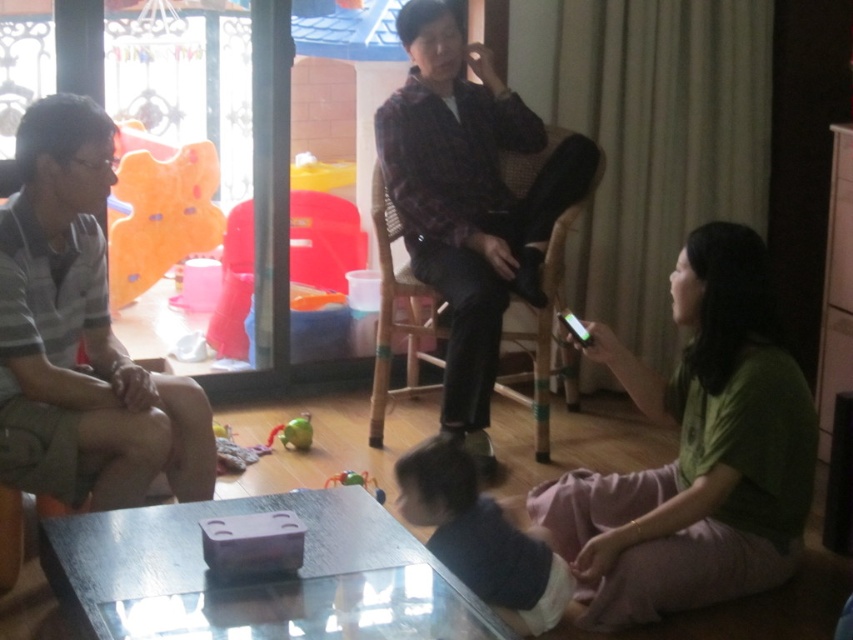
Between striped cotton shirt at left and rubberized green spider at lower center, which one has more height?

striped cotton shirt at left is taller.

This screenshot has height=640, width=853. Describe the element at coordinates (80, 336) in the screenshot. I see `striped cotton shirt at left` at that location.

At what (x,y) coordinates should I click in order to perform the action: click on striped cotton shirt at left. Please return your answer as a coordinate pair (x, y). Looking at the image, I should click on (80, 336).

Which of these two, striped cotton shirt at left or transparent plastic glass door at left, stands shorter?

With less height is striped cotton shirt at left.

Is striped cotton shirt at left positioned at the back of transparent plastic glass door at left?

No, striped cotton shirt at left is in front of transparent plastic glass door at left.

Identify the location of striped cotton shirt at left. This screenshot has height=640, width=853. (80, 336).

Identify the location of striped cotton shirt at left. tap(80, 336).

Can you confirm if dark blue fabric at lower center is positioned above soft plush bear at upper left?

Incorrect, dark blue fabric at lower center is not positioned above soft plush bear at upper left.

Does point (412, 492) lie in front of point (132, 266)?

Yes.

Where is `dark blue fabric at lower center`? This screenshot has width=853, height=640. dark blue fabric at lower center is located at coordinates (480, 536).